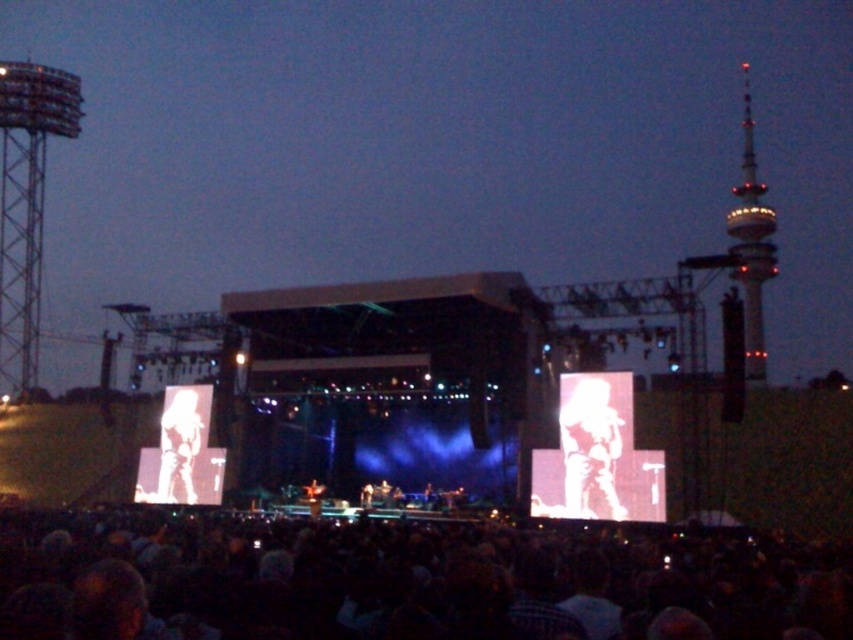
You are a photographer at the concert and want to capture a photo that includes both the silhouette figure at center and the metallic tower at right. Based on their heights, which object should you focus on first to ensure both are in frame?

Since the silhouette figure at center is shorter than the metallic tower at right, you should focus on the silhouette figure at center first to ensure both are in frame.

You are a photographer at the concert. You want to capture a photo that includes both the dark matte crowd at lower center and the silhouette figure at center. Which object should you focus on first to ensure both are in frame?

The dark matte crowd at lower center is bigger than the silhouette figure at center, so you should focus on the dark matte crowd at lower center first to ensure both fit in the frame.

You are a photographer trying to capture a photo of the silhouette figure at center and the metallic tower at right. Based on their positions, which object should you focus on first if you want to include both in your shot without moving the camera?

The silhouette figure at center is located below the metallic tower at right, so you should focus on the silhouette figure at center first to ensure both are in frame without moving the camera.